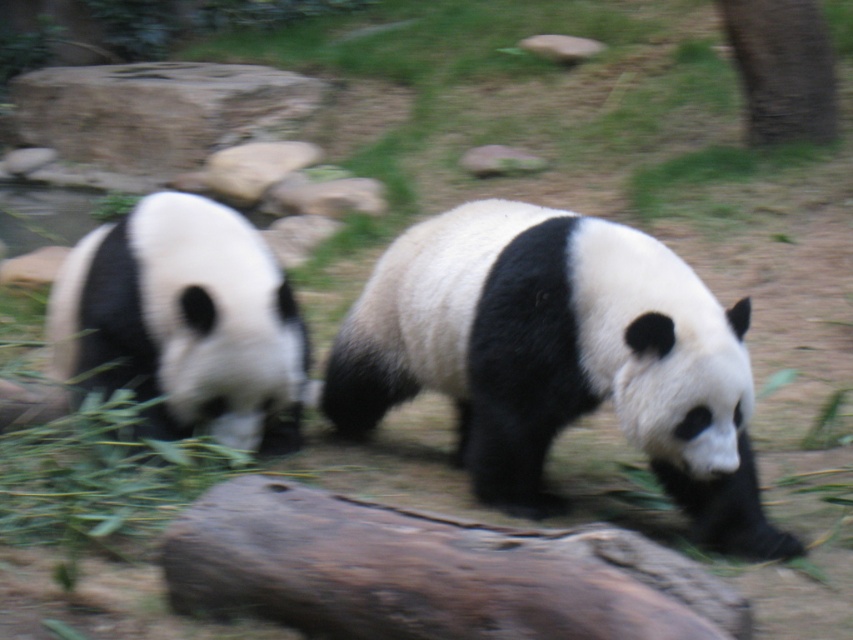
This screenshot has width=853, height=640. In order to click on black and white fur panda at left in this screenshot , I will do `click(184, 323)`.

Which of these two, black and white fur panda at center or black and white fur panda at left, stands taller?

black and white fur panda at center

Is point (694, 422) positioned before point (221, 257)?

Yes, point (694, 422) is closer to viewer.

Identify the location of black and white fur panda at center. (558, 358).

Who is more distant from viewer, (740, 636) or (213, 332)?

Positioned behind is point (213, 332).

Does point (621, 628) come in front of point (271, 449)?

Yes, it is in front of point (271, 449).

Where is `brown rough log at center`? The width and height of the screenshot is (853, 640). brown rough log at center is located at coordinates (428, 572).